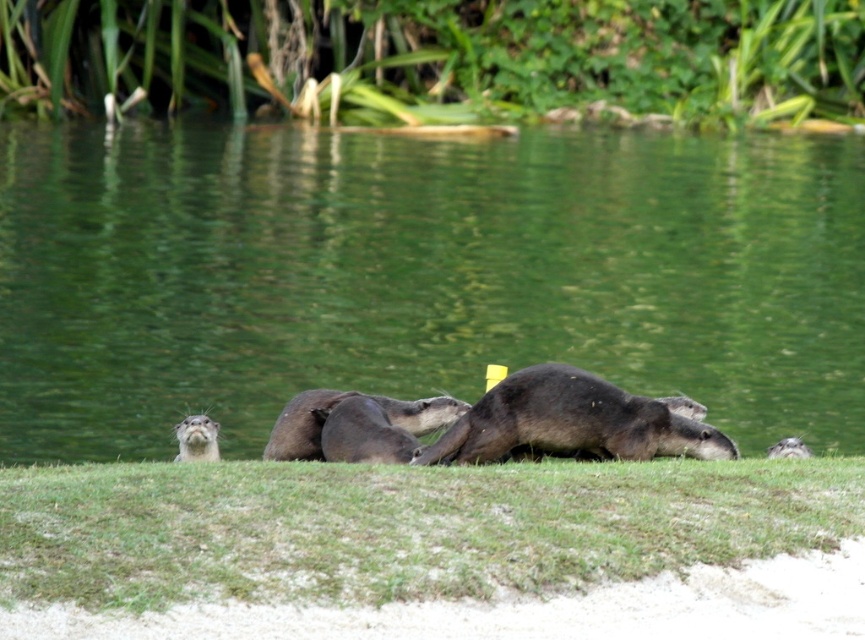
You are an otter observer standing on the bank. You see the green grass at lower center and the dark brown fur otter at center. Which object is located below the other?

The green grass at lower center is positioned under the dark brown fur otter at center, so the grass is below the otter.

You are a small animal that needs to cross from the green grass at lower center to the brown fur otter at center. Can you safely jump the gap between them if your maximum jump distance is 1.8 meters?

The distance between the green grass at lower center and the brown fur otter at center is 2.03 meters, which is greater than your maximum jump distance of 1.8 meters. Therefore, you cannot safely jump the gap between them.